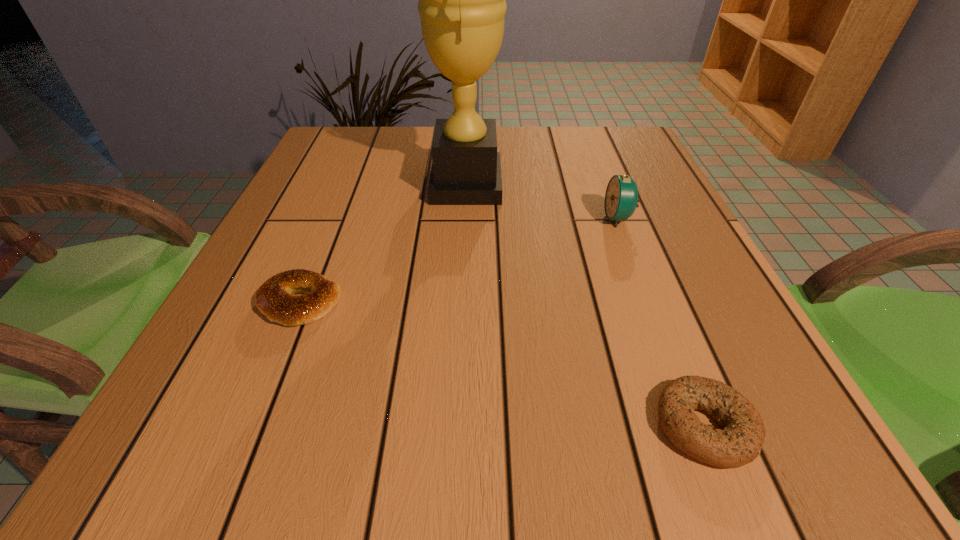
This screenshot has width=960, height=540. In order to click on free space that satisfies the following two spatial constraints: 1. at the front of the second object from left to right with handles; 2. on the left side of the nearest object in this screenshot , I will do `click(456, 426)`.

The width and height of the screenshot is (960, 540). What are the coordinates of `vacant space that satisfies the following two spatial constraints: 1. at the front of the trophy cup with handles; 2. on the left side of the nearest object` in the screenshot? It's located at (456, 426).

You are a GUI agent. You are given a task and a screenshot of the screen. Output one action in this format:
    pyautogui.click(x=<x>, y=<y>)
    Task: Click on the free spot that satisfies the following two spatial constraints: 1. on the front-facing side of the nearer bagel; 2. on the right side of the second tallest object
    The image size is (960, 540).
    Given the screenshot: What is the action you would take?
    pyautogui.click(x=700, y=426)

The height and width of the screenshot is (540, 960). Find the location of `vacant space that satisfies the following two spatial constraints: 1. on the front-facing side of the alarm clock; 2. on the left side of the right bagel`. vacant space that satisfies the following two spatial constraints: 1. on the front-facing side of the alarm clock; 2. on the left side of the right bagel is located at coordinates (700, 426).